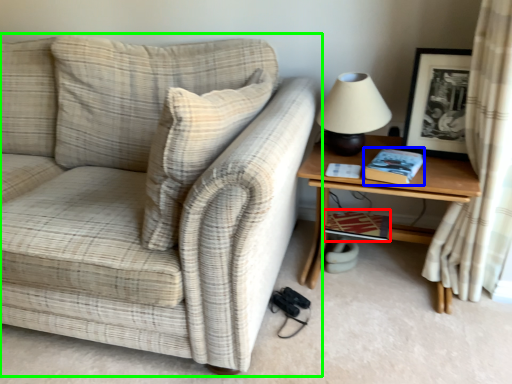
Question: Based on their relative distances, which object is nearer to book (highlighted by a red box)? Choose from book (highlighted by a blue box) and studio couch (highlighted by a green box).

Choices:
 (A) book
 (B) studio couch

Answer: (A)